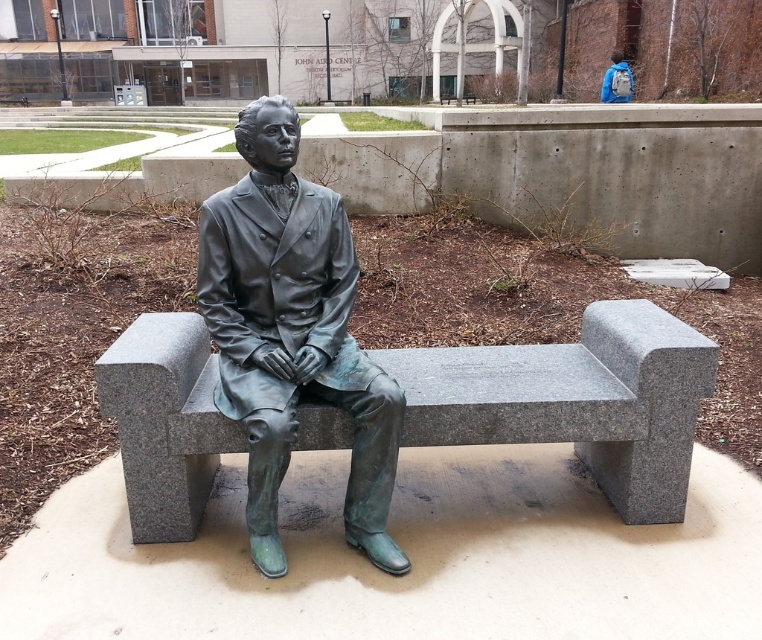
You are a landscape architect designing a new garden layout. You need to place a new decorative fountain that requires a base at least as large as the granite bench at center. Can the bronze statue at center be moved to the side to accommodate this fountain? Explain your reasoning based on the sizes of the objects.

The granite bench at center is larger than the bronze statue at center. Since the fountain requires a base at least as large as the granite bench, the bronze statue at center can be moved to the side because its smaller size allows it to be relocated without obstructing the required space for the fountain.